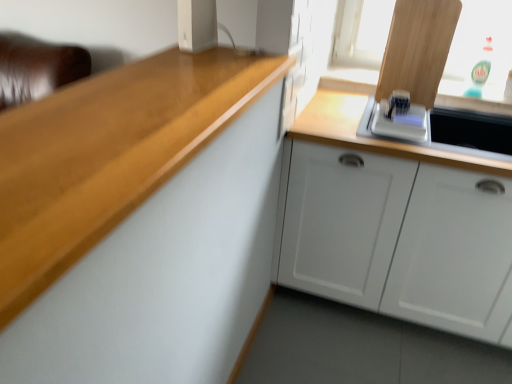
At what (x,y) coordinates should I click in order to perform the action: click on white glossy microwave at upper right. Please return your answer as a coordinate pair (x, y). The width and height of the screenshot is (512, 384). Looking at the image, I should click on (378, 138).

The width and height of the screenshot is (512, 384). What do you see at coordinates (399, 239) in the screenshot?
I see `white matte cabinet at lower right, which is counted as the 2th cabinetry, starting from the left` at bounding box center [399, 239].

How much space does wooden countertop at left, which ranks as the second cabinetry in back-to-front order, occupy horizontally?

wooden countertop at left, which ranks as the second cabinetry in back-to-front order, is 14.12 inches wide.

Where is `white glossy microwave at upper right`? The image size is (512, 384). white glossy microwave at upper right is located at coordinates (378, 138).

Measure the distance between white plastic toaster at upper right, arranged as the first appliance when viewed from the back, and white plastic speaker at upper center, the first appliance viewed from the front.

white plastic toaster at upper right, arranged as the first appliance when viewed from the back, and white plastic speaker at upper center, the first appliance viewed from the front, are 28.02 inches apart from each other.

From the image's perspective, does white plastic toaster at upper right, arranged as the first appliance when viewed from the back, appear lower than white plastic speaker at upper center, positioned as the 2th appliance in back-to-front order?

Yes, from the image's perspective, white plastic toaster at upper right, arranged as the first appliance when viewed from the back, is beneath white plastic speaker at upper center, positioned as the 2th appliance in back-to-front order.

Could you tell me if white plastic toaster at upper right, the 1th appliance when ordered from right to left, is facing white plastic speaker at upper center, positioned as the 2th appliance in back-to-front order?

No, white plastic toaster at upper right, the 1th appliance when ordered from right to left, is not oriented towards white plastic speaker at upper center, positioned as the 2th appliance in back-to-front order.

Can you confirm if white plastic toaster at upper right, placed as the second appliance when sorted from front to back, is smaller than white plastic speaker at upper center, which is the 1th appliance from left to right?

Incorrect, white plastic toaster at upper right, placed as the second appliance when sorted from front to back, is not smaller in size than white plastic speaker at upper center, which is the 1th appliance from left to right.

Is white glossy microwave at upper right bigger than white matte cabinet at lower right, the first cabinetry positioned from the right?

Incorrect, white glossy microwave at upper right is not larger than white matte cabinet at lower right, the first cabinetry positioned from the right.

Is white glossy microwave at upper right oriented away from white matte cabinet at lower right, the first cabinetry positioned from the right?

Yes.

Is white glossy microwave at upper right inside or outside of white matte cabinet at lower right, marked as the first cabinetry in a back-to-front arrangement?

white glossy microwave at upper right is enclosed within white matte cabinet at lower right, marked as the first cabinetry in a back-to-front arrangement.

Identify the location of countertop to the right of white matte cabinet at lower right, which is counted as the 2th cabinetry, starting from the left. (378, 138).

Is white matte cabinet at lower right, the first cabinetry positioned from the right, surrounding white plastic toaster at upper right, arranged as the first appliance when viewed from the back?

No, white plastic toaster at upper right, arranged as the first appliance when viewed from the back, is not a part of white matte cabinet at lower right, the first cabinetry positioned from the right.

In terms of size, does white matte cabinet at lower right, which is counted as the 2th cabinetry, starting from the left, appear bigger or smaller than white plastic toaster at upper right, arranged as the first appliance when viewed from the back?

Considering their sizes, white matte cabinet at lower right, which is counted as the 2th cabinetry, starting from the left, takes up more space than white plastic toaster at upper right, arranged as the first appliance when viewed from the back.

Is the position of white matte cabinet at lower right, marked as the first cabinetry in a back-to-front arrangement, more distant than that of white plastic toaster at upper right, placed as the second appliance when sorted from front to back?

No, the depth of white matte cabinet at lower right, marked as the first cabinetry in a back-to-front arrangement, is less than that of white plastic toaster at upper right, placed as the second appliance when sorted from front to back.

From a real-world perspective, is white matte cabinet at lower right, marked as the first cabinetry in a back-to-front arrangement, physically above white plastic toaster at upper right, arranged as the first appliance when viewed from the back?

No, from a real-world perspective, white matte cabinet at lower right, marked as the first cabinetry in a back-to-front arrangement, is not over white plastic toaster at upper right, arranged as the first appliance when viewed from the back

Which is in front, point (183, 0) or point (377, 200)?

Positioned in front is point (183, 0).

Considering the relative sizes of white plastic speaker at upper center, the first appliance viewed from the front, and white matte cabinet at lower right, the first cabinetry positioned from the right, in the image provided, is white plastic speaker at upper center, the first appliance viewed from the front, shorter than white matte cabinet at lower right, the first cabinetry positioned from the right,?

Correct, white plastic speaker at upper center, the first appliance viewed from the front, is not as tall as white matte cabinet at lower right, the first cabinetry positioned from the right.

Is white plastic speaker at upper center, positioned as the 2th appliance in back-to-front order, completely or partially outside of white matte cabinet at lower right, which is counted as the 2th cabinetry, starting from the left?

Yes, white plastic speaker at upper center, positioned as the 2th appliance in back-to-front order, is not within white matte cabinet at lower right, which is counted as the 2th cabinetry, starting from the left.

How far apart are white plastic toaster at upper right, the 1th appliance when ordered from right to left, and white matte cabinet at lower right, which is counted as the 2th cabinetry, starting from the left?

A distance of 40.09 centimeters exists between white plastic toaster at upper right, the 1th appliance when ordered from right to left, and white matte cabinet at lower right, which is counted as the 2th cabinetry, starting from the left.

Is white matte cabinet at lower right, the first cabinetry positioned from the right, located within white plastic toaster at upper right, which is the second appliance from left to right?

Definitely not — white matte cabinet at lower right, the first cabinetry positioned from the right, is not inside white plastic toaster at upper right, which is the second appliance from left to right.

There is a white plastic toaster at upper right, placed as the second appliance when sorted from front to back. Where is `the 2nd cabinetry below it (from the image's perspective)`? the 2nd cabinetry below it (from the image's perspective) is located at coordinates (399, 239).

Considering the positions of point (407, 128) and point (310, 290), is point (407, 128) closer or farther from the camera than point (310, 290)?

Point (407, 128).

Do you think wooden countertop at left, the second cabinetry in the right-to-left sequence, is within white glossy microwave at upper right, or outside of it?

wooden countertop at left, the second cabinetry in the right-to-left sequence, is not enclosed by white glossy microwave at upper right.

Is wooden countertop at left, which ranks as the second cabinetry in back-to-front order, to the left or to the right of white glossy microwave at upper right in the image?

From the image, it's evident that wooden countertop at left, which ranks as the second cabinetry in back-to-front order, is to the left of white glossy microwave at upper right.

From a real-world perspective, is wooden countertop at left, which ranks as the second cabinetry in back-to-front order, positioned under white glossy microwave at upper right based on gravity?

No.

Considering the sizes of objects white plastic toaster at upper right, arranged as the first appliance when viewed from the back, and wooden countertop at left, which ranks as the first cabinetry in left-to-right order, in the image provided, who is smaller, white plastic toaster at upper right, arranged as the first appliance when viewed from the back, or wooden countertop at left, which ranks as the first cabinetry in left-to-right order,?

With smaller size is white plastic toaster at upper right, arranged as the first appliance when viewed from the back.

Which of these two, white plastic toaster at upper right, which is the second appliance from left to right, or wooden countertop at left, which ranks as the first cabinetry in left-to-right order, stands taller?

white plastic toaster at upper right, which is the second appliance from left to right.

Is white plastic toaster at upper right, placed as the second appliance when sorted from front to back, placed right next to wooden countertop at left, the second cabinetry in the right-to-left sequence?

No, white plastic toaster at upper right, placed as the second appliance when sorted from front to back, is not beside wooden countertop at left, the second cabinetry in the right-to-left sequence.

From the image's perspective, is white plastic toaster at upper right, placed as the second appliance when sorted from front to back, positioned above or below wooden countertop at left, which is the 1th cabinetry from front to back?

Based on their image positions, white plastic toaster at upper right, placed as the second appliance when sorted from front to back, is located above wooden countertop at left, which is the 1th cabinetry from front to back.

At what (x,y) coordinates should I click in order to perform the action: click on appliance located behind the white plastic speaker at upper center, positioned as the 2th appliance in back-to-front order. Please return your answer as a coordinate pair (x, y). The width and height of the screenshot is (512, 384). Looking at the image, I should click on (400, 122).

Where is `countertop above the white matte cabinet at lower right, which is counted as the 2th cabinetry, starting from the left (from the image's perspective)`? The image size is (512, 384). countertop above the white matte cabinet at lower right, which is counted as the 2th cabinetry, starting from the left (from the image's perspective) is located at coordinates (378, 138).

Which object lies further to the anchor point white plastic speaker at upper center, the first appliance viewed from the front, white glossy microwave at upper right or white matte cabinet at lower right, positioned as the 2th cabinetry in front-to-back order?

The object further to white plastic speaker at upper center, the first appliance viewed from the front, is white matte cabinet at lower right, positioned as the 2th cabinetry in front-to-back order.

From the image, which object appears to be nearer to wooden countertop at left, the second cabinetry in the right-to-left sequence, white glossy microwave at upper right or white plastic toaster at upper right, which is the second appliance from left to right?

Among the two, white glossy microwave at upper right is located nearer to wooden countertop at left, the second cabinetry in the right-to-left sequence.

When comparing their distances from white matte cabinet at lower right, marked as the first cabinetry in a back-to-front arrangement, does white plastic toaster at upper right, arranged as the first appliance when viewed from the back, or wooden countertop at left, which ranks as the second cabinetry in back-to-front order, seem closer?

white plastic toaster at upper right, arranged as the first appliance when viewed from the back, is closer to white matte cabinet at lower right, marked as the first cabinetry in a back-to-front arrangement.

When comparing their distances from white glossy microwave at upper right, does white plastic speaker at upper center, the second appliance viewed from the right, or white plastic toaster at upper right, the 1th appliance when ordered from right to left, seem further?

white plastic speaker at upper center, the second appliance viewed from the right, is positioned further to the anchor white glossy microwave at upper right.

When comparing their distances from white matte cabinet at lower right, the first cabinetry positioned from the right, does white plastic speaker at upper center, positioned as the 2th appliance in back-to-front order, or white plastic toaster at upper right, which is the second appliance from left to right, seem closer?

Among the two, white plastic toaster at upper right, which is the second appliance from left to right, is located nearer to white matte cabinet at lower right, the first cabinetry positioned from the right.

Based on their spatial positions, is white glossy microwave at upper right or white plastic speaker at upper center, positioned as the 2th appliance in back-to-front order, closer to white plastic toaster at upper right, which is the second appliance from left to right?

white glossy microwave at upper right.

When comparing their distances from white plastic toaster at upper right, the 1th appliance when ordered from right to left, does white plastic speaker at upper center, the second appliance viewed from the right, or white matte cabinet at lower right, marked as the first cabinetry in a back-to-front arrangement, seem closer?

white matte cabinet at lower right, marked as the first cabinetry in a back-to-front arrangement, is closer to white plastic toaster at upper right, the 1th appliance when ordered from right to left.

Based on their spatial positions, is white matte cabinet at lower right, positioned as the 2th cabinetry in front-to-back order, or wooden countertop at left, which ranks as the first cabinetry in left-to-right order, further from white plastic toaster at upper right, arranged as the first appliance when viewed from the back?

Among the two, wooden countertop at left, which ranks as the first cabinetry in left-to-right order, is located further to white plastic toaster at upper right, arranged as the first appliance when viewed from the back.

You are a GUI agent. You are given a task and a screenshot of the screen. Output one action in this format:
    pyautogui.click(x=<x>, y=<y>)
    Task: Click on the appliance between white plastic speaker at upper center, the second appliance viewed from the right, and white glossy microwave at upper right
    
    Given the screenshot: What is the action you would take?
    pyautogui.click(x=400, y=122)

Locate an element on the screen. cabinetry located between white plastic speaker at upper center, positioned as the 2th appliance in back-to-front order, and white glossy microwave at upper right in the left-right direction is located at coordinates (399, 239).

Locate an element on the screen. The width and height of the screenshot is (512, 384). cabinetry between wooden countertop at left, which ranks as the second cabinetry in back-to-front order, and white glossy microwave at upper right is located at coordinates (399, 239).

Find the location of a particular element. cabinetry located between wooden countertop at left, which is the 1th cabinetry from front to back, and white plastic toaster at upper right, the 1th appliance when ordered from right to left, in the depth direction is located at coordinates (399, 239).